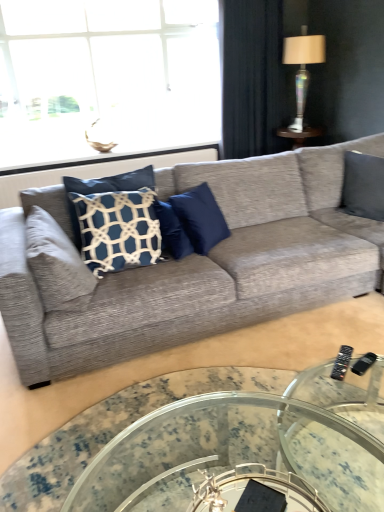
Question: Is clear glass window at upper left surrounding white textured pillow at left, which appears as the 2th pillow when viewed from the right?

Choices:
 (A) yes
 (B) no

Answer: (B)

Question: Is clear glass window at upper left to the left of white textured pillow at left, which appears as the 2th pillow when viewed from the right, from the viewer's perspective?

Choices:
 (A) no
 (B) yes

Answer: (B)

Question: Can you confirm if clear glass window at upper left is smaller than white textured pillow at left, which appears as the 2th pillow when viewed from the right?

Choices:
 (A) no
 (B) yes

Answer: (A)

Question: Would you say clear glass window at upper left is outside white textured pillow at left, placed as the 1th pillow when sorted from left to right?

Choices:
 (A) no
 (B) yes

Answer: (B)

Question: Considering the relative positions of clear glass window at upper left and white textured pillow at left, which appears as the 2th pillow when viewed from the right, in the image provided, is clear glass window at upper left behind white textured pillow at left, which appears as the 2th pillow when viewed from the right,?

Choices:
 (A) yes
 (B) no

Answer: (A)

Question: Is point (225, 118) positioned closer to the camera than point (67, 456)?

Choices:
 (A) farther
 (B) closer

Answer: (A)

Question: Considering the positions of dark blue fabric curtain at upper right and transparent glass coffee table at lower center in the image, is dark blue fabric curtain at upper right taller or shorter than transparent glass coffee table at lower center?

Choices:
 (A) short
 (B) tall

Answer: (B)

Question: Would you say dark blue fabric curtain at upper right is to the left or to the right of transparent glass coffee table at lower center in the picture?

Choices:
 (A) right
 (B) left

Answer: (A)

Question: Is dark blue fabric curtain at upper right in front of or behind transparent glass coffee table at lower center in the image?

Choices:
 (A) front
 (B) behind

Answer: (B)

Question: Is textured gray couch at center wider or thinner than translucent glass lampshade at upper right?

Choices:
 (A) wide
 (B) thin

Answer: (A)

Question: Relative to translucent glass lampshade at upper right, is textured gray couch at center in front or behind?

Choices:
 (A) front
 (B) behind

Answer: (A)

Question: Considering the positions of textured gray couch at center and translucent glass lampshade at upper right in the image, is textured gray couch at center taller or shorter than translucent glass lampshade at upper right?

Choices:
 (A) short
 (B) tall

Answer: (A)

Question: From the image's perspective, is textured gray couch at center located above or below translucent glass lampshade at upper right?

Choices:
 (A) below
 (B) above

Answer: (A)

Question: In the image, is blue velvet pillow at center, positioned as the first pillow in right-to-left order, on the left side or the right side of translucent glass lampshade at upper right?

Choices:
 (A) right
 (B) left

Answer: (B)

Question: Relative to translucent glass lampshade at upper right, is blue velvet pillow at center, positioned as the first pillow in right-to-left order, in front or behind?

Choices:
 (A) behind
 (B) front

Answer: (B)